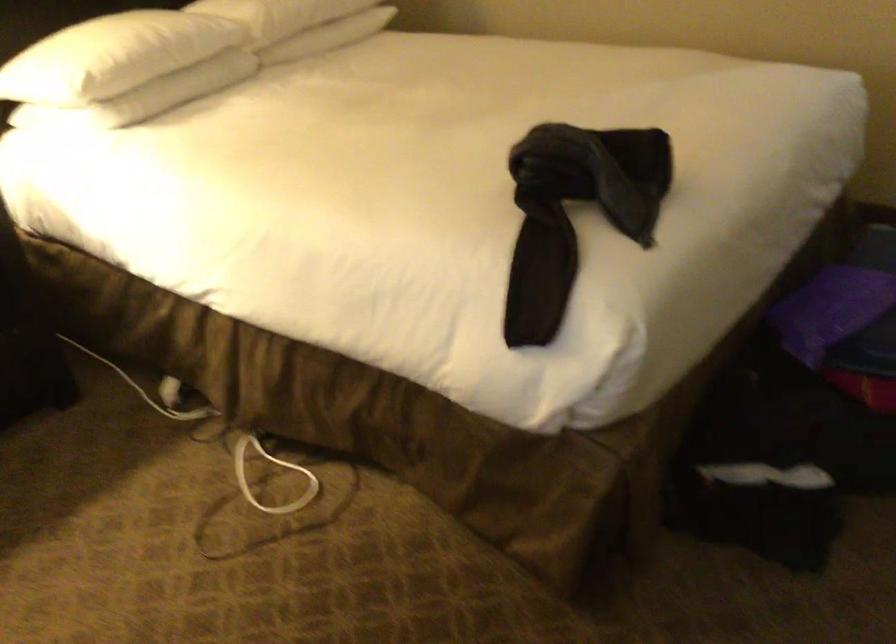
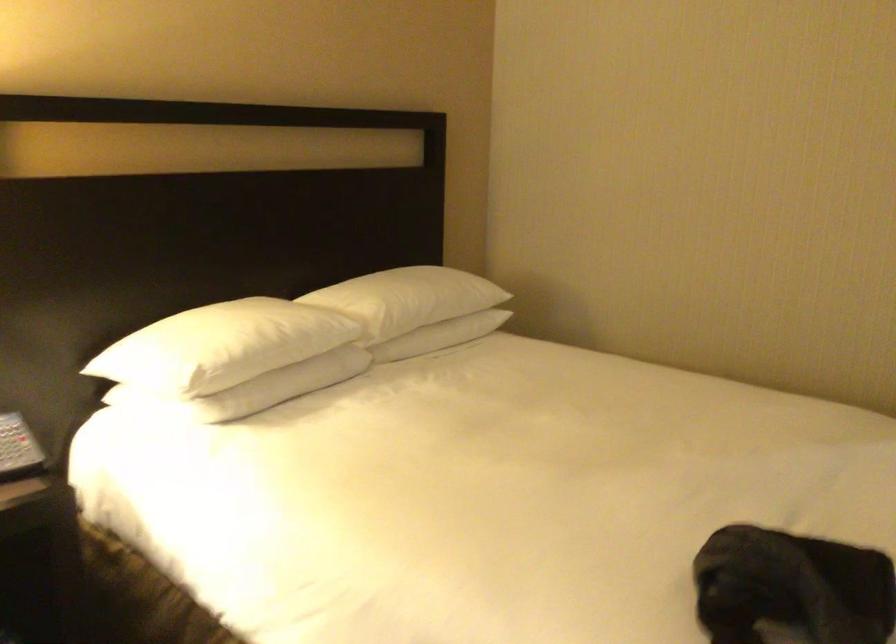
Question: The first image is from the beginning of the video and the second image is from the end. How did the camera likely rotate when shooting the video?

Choices:
 (A) Left
 (B) Right
 (C) Up
 (D) Down

Answer: (C)